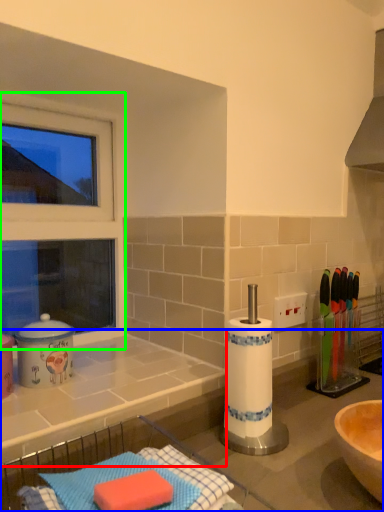
Question: Which object is positioned closest to countertop (highlighted by a red box)? Select from countertop (highlighted by a blue box) and window frame (highlighted by a green box).

Choices:
 (A) countertop
 (B) window frame

Answer: (A)